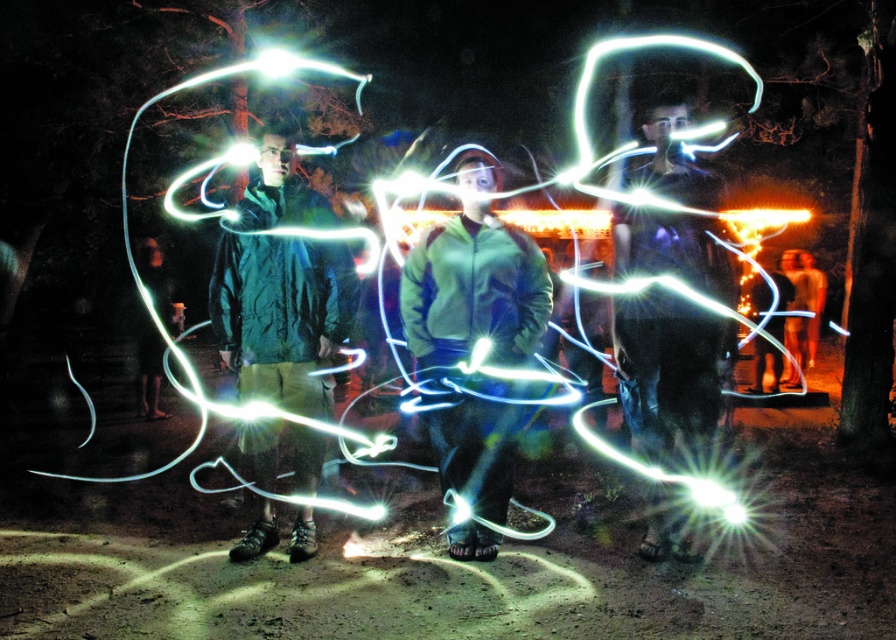
You are organizing a light painting workshop and need to arrange two jackets for a demonstration. The jackets are the green matte jacket at center and the green fleece jacket at center. According to the scene, which jacket is located to the left of the other?

The green matte jacket at center is positioned on the left side of the green fleece jacket at center.

You are a photographer who wants to capture the light trails in the image. You need to place a new light source at a specific coordinate to align with the green fleece jacket at center. What coordinate should you use?

The green fleece jacket at center is located at coordinate point (472, 291), so you should place the new light source at the same coordinate to align with it.

You are an observer looking at the nighttime scene with light trails. There are two green jackets at the center of the image. Which one is closer to you, the green matte jacket at center or the green fleece jacket at center?

The green matte jacket at center is closer to you because it is further to the viewer than the green fleece jacket at center.